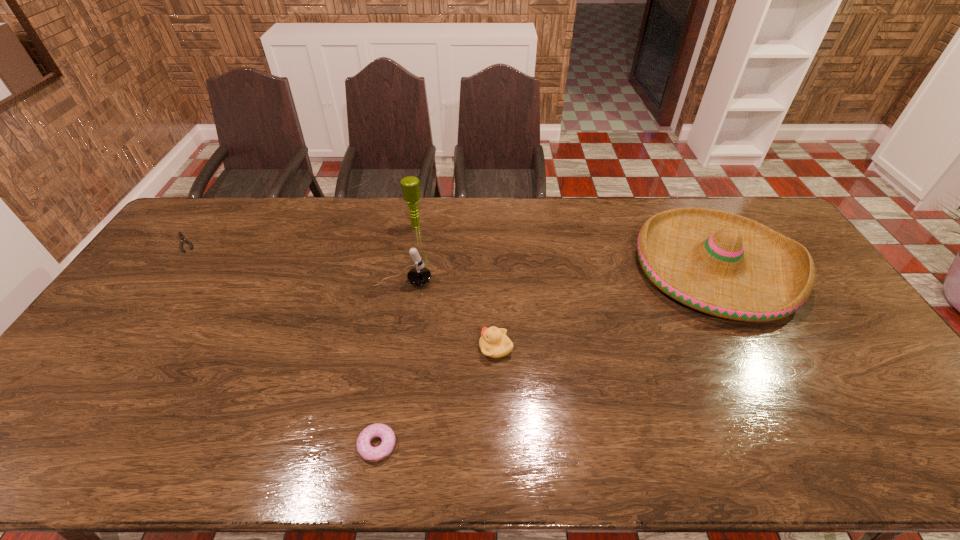
Locate an element on the screen. the farther microphone is located at coordinates (410, 185).

Image resolution: width=960 pixels, height=540 pixels. Identify the location of the tallest object. (410, 185).

At what (x,y) coordinates should I click in order to perform the action: click on the rightmost object. Please return your answer as a coordinate pair (x, y). Looking at the image, I should click on (719, 263).

Locate an element on the screen. The width and height of the screenshot is (960, 540). the nearer microphone is located at coordinates (419, 275).

Where is `the second nearest object`? Image resolution: width=960 pixels, height=540 pixels. the second nearest object is located at coordinates pos(494,343).

Locate an element on the screen. duckling is located at coordinates (494, 343).

Identify the location of the nearest object. (372, 454).

The image size is (960, 540). I want to click on the fifth tallest object, so click(x=372, y=454).

You are a GUI agent. You are given a task and a screenshot of the screen. Output one action in this format:
    pyautogui.click(x=<x>, y=<y>)
    Task: Click on the pliers
    The width and height of the screenshot is (960, 540).
    Given the screenshot: What is the action you would take?
    pyautogui.click(x=181, y=236)

Locate an element on the screen. Image resolution: width=960 pixels, height=540 pixels. the leftmost object is located at coordinates (181, 236).